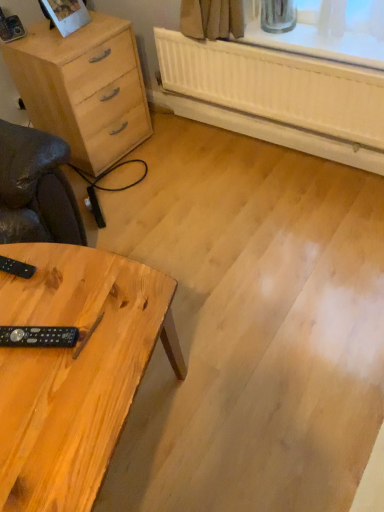
Question: Considering the positions of natural wood chest of drawers at left and natural wood table at lower left in the image, is natural wood chest of drawers at left bigger or smaller than natural wood table at lower left?

Choices:
 (A) small
 (B) big

Answer: (A)

Question: Is natural wood chest of drawers at left situated inside natural wood table at lower left or outside?

Choices:
 (A) outside
 (B) inside

Answer: (A)

Question: Considering the real-world distances, which object is closest to the black plastic remote at lower left, acting as the first control starting from the front?

Choices:
 (A) black plastic remote at lower left, acting as the 1th control starting from the top
 (B) natural wood table at lower left
 (C) natural wood chest of drawers at left

Answer: (B)

Question: Which is farther from the natural wood chest of drawers at left?

Choices:
 (A) black plastic remote at lower left, acting as the 1th control starting from the bottom
 (B) black plastic remote at lower left, acting as the 1th control starting from the top
 (C) natural wood table at lower left

Answer: (A)